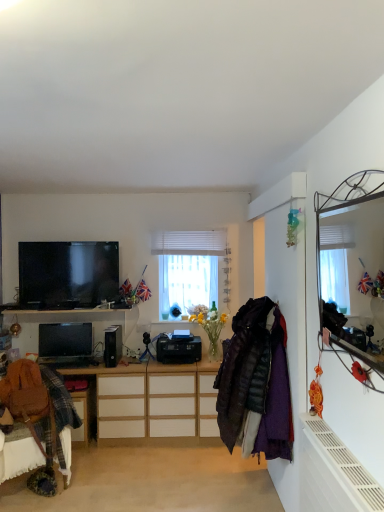
Where is `vacant region above white matte radiator at lower right (from a real-world perspective)`? vacant region above white matte radiator at lower right (from a real-world perspective) is located at coordinates (345, 451).